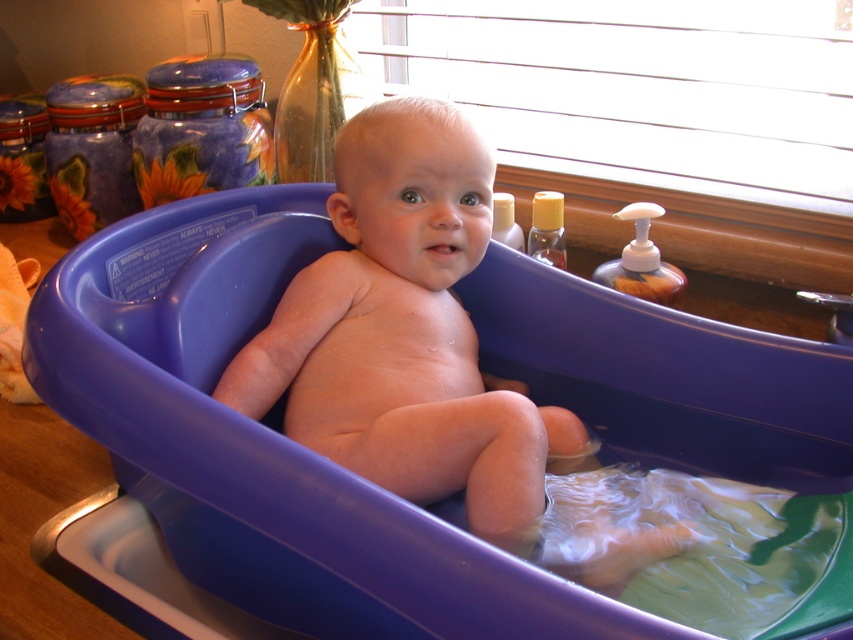
Between purple plastic tub at center and smooth plastic baby at center, which one has more height?

With more height is smooth plastic baby at center.

Between purple plastic tub at center and smooth plastic baby at center, which one appears on the right side from the viewer's perspective?

From the viewer's perspective, purple plastic tub at center appears more on the right side.

Who is more distant from viewer, (787, 472) or (268, 371)?

Point (787, 472)

This screenshot has width=853, height=640. I want to click on purple plastic tub at center, so click(265, 440).

How far apart are purple plastic tub at center and translucent plastic soap dispenser at right?

purple plastic tub at center and translucent plastic soap dispenser at right are 15.71 inches apart from each other.

Between point (550, 371) and point (639, 259), which one is positioned in front?

Point (550, 371)

Who is more forward, [195,541] or [634,216]?

Positioned in front is point [195,541].

In order to click on purple plastic tub at center in this screenshot , I will do `click(265, 440)`.

Is point (374, 195) closer to viewer compared to point (642, 253)?

Yes.

Where is `smooth plastic baby at center`? smooth plastic baby at center is located at coordinates (405, 332).